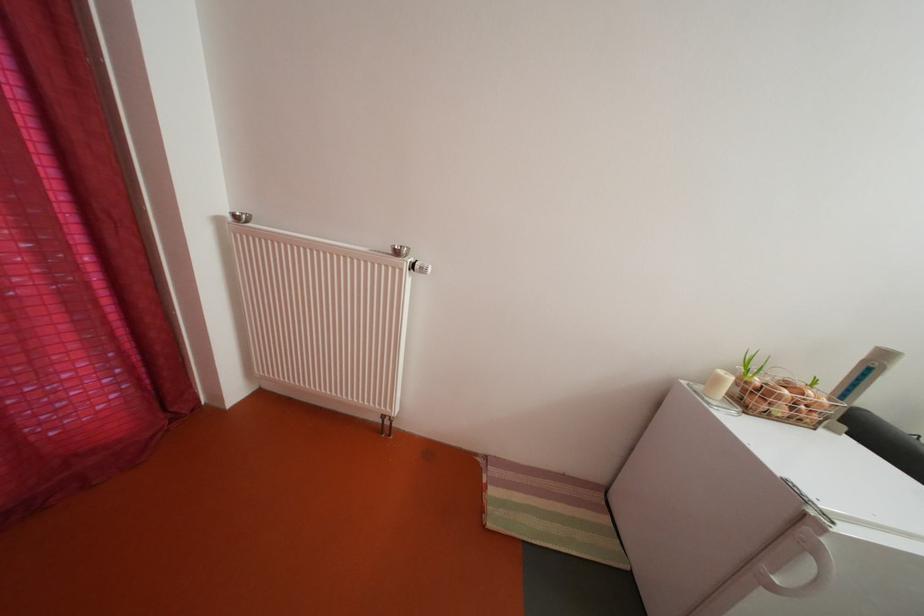
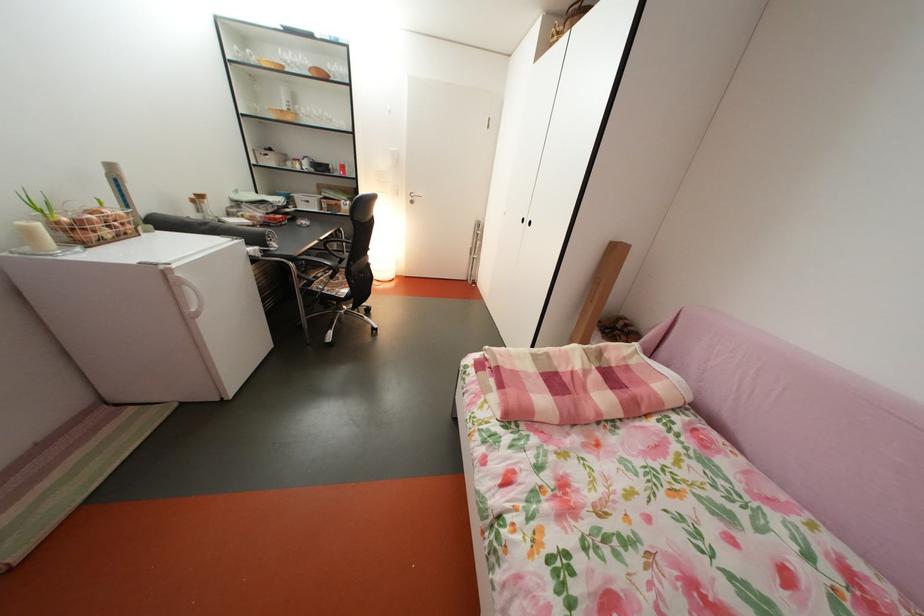
Locate, in the second image, the point that corresponds to point 792,416 in the first image.

(118, 238)